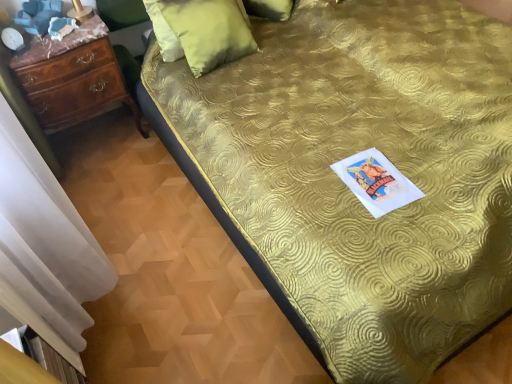
Question: Would you say gold textured bedspread at center is to the left or to the right of velvet green pillow at upper center, which is counted as the second pillow, starting from the back, in the picture?

Choices:
 (A) right
 (B) left

Answer: (A)

Question: From their relative heights in the image, would you say gold textured bedspread at center is taller or shorter than velvet green pillow at upper center, which is counted as the second pillow, starting from the back?

Choices:
 (A) short
 (B) tall

Answer: (A)

Question: Which object is positioned closest to the gold textured bedspread at center?

Choices:
 (A) velvet green pillow at upper center, which is counted as the second pillow, starting from the back
 (B) green velvet pillow at upper center, positioned as the 1th pillow in back-to-front order
 (C) mahogany wood chest of drawers at left
 (D) white sheer curtain at left

Answer: (A)

Question: Estimate the real-world distances between objects in this image. Which object is closer to the velvet green pillow at upper center, which is the 1th pillow in front-to-back order?

Choices:
 (A) green velvet pillow at upper center, positioned as the 1th pillow in back-to-front order
 (B) white sheer curtain at left
 (C) gold textured bedspread at center
 (D) mahogany wood chest of drawers at left

Answer: (A)